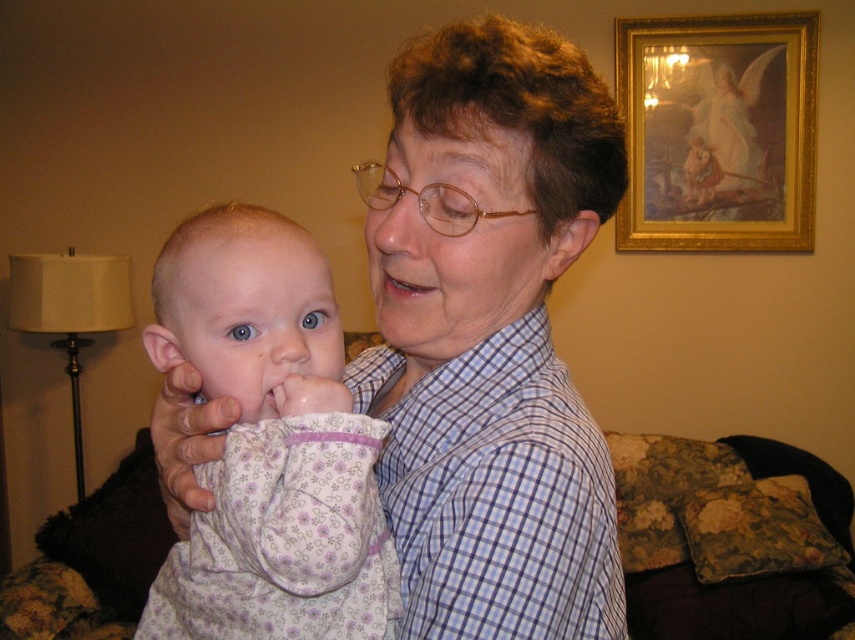
Question: Which point appears farthest from the camera in this image?

Choices:
 (A) (423, 289)
 (B) (236, 483)
 (C) (680, 186)
 (D) (582, 504)

Answer: (C)

Question: Which object is positioned farthest from the pink glossy lips at center?

Choices:
 (A) fluffy white blanket at center
 (B) blue plaid shirt at center
 (C) gold-framed painting at upper right
 (D) blue checkered shirt at center

Answer: (C)

Question: Does gold-framed painting at upper right appear over pink glossy lips at center?

Choices:
 (A) yes
 (B) no

Answer: (A)

Question: Does gold-framed painting at upper right lie behind pink glossy lips at center?

Choices:
 (A) no
 (B) yes

Answer: (B)

Question: Among these points, which one is nearest to the camera?

Choices:
 (A) [640, 230]
 (B) [416, 237]
 (C) [432, 282]

Answer: (B)

Question: Can you confirm if blue checkered shirt at center is positioned below gold-framed painting at upper right?

Choices:
 (A) no
 (B) yes

Answer: (B)